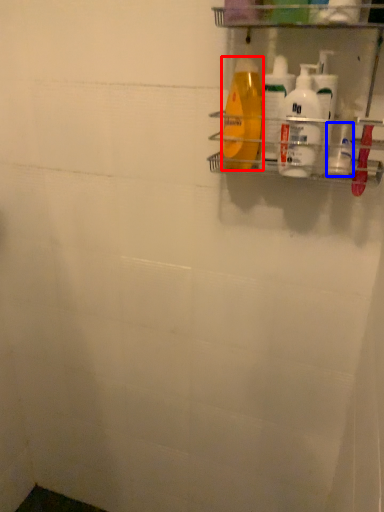
Question: Which point is closer to the camera, cleaning product (highlighted by a red box) or toiletry (highlighted by a blue box)?

Choices:
 (A) cleaning product
 (B) toiletry

Answer: (A)